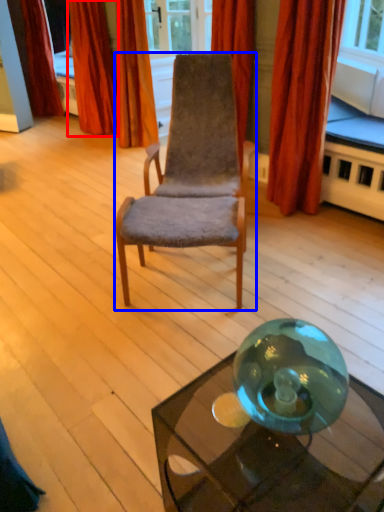
Question: Among these objects, which one is farthest to the camera, curtain (highlighted by a red box) or chair (highlighted by a blue box)?

Choices:
 (A) curtain
 (B) chair

Answer: (A)